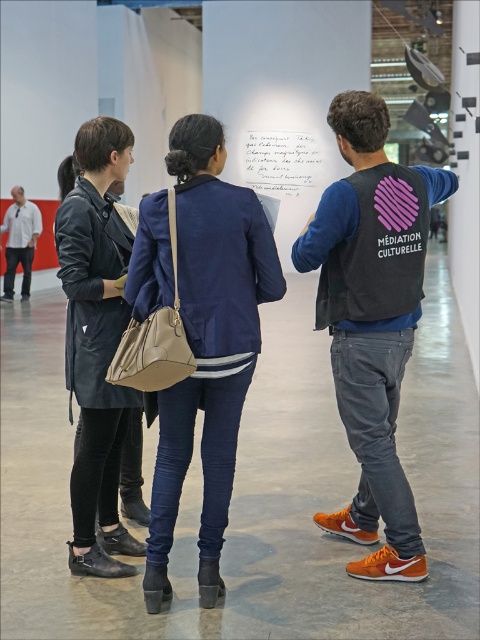
Where is the leather jacket at left located in the image?

The leather jacket at left is located at point (96, 339) in the image.

From the picture: You are an artist trying to decide where to place a new sculpture in the gallery. The sculpture is designed to be placed between the navy blue fabric jacket at center and the leather jacket at left. Since the sculpture requires a space that accommodates both jackets, which jacket should be positioned closer to the sculpture to ensure it fits properly?

The navy blue fabric jacket at center should be positioned closer to the sculpture because it has a smaller size compared to the leather jacket at left, allowing the sculpture to fit between them appropriately.